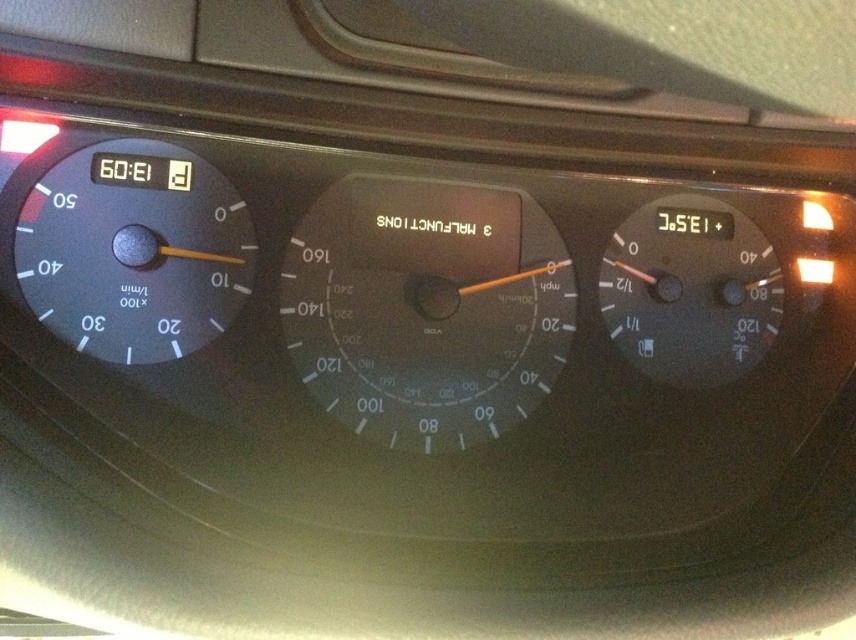
Question: Which object appears farthest from the camera in this image?

Choices:
 (A) black plastic speedometer at left
 (B) transparent glass speedometer at center

Answer: (B)

Question: Can you confirm if black plastic speedometer at left is positioned below matte black speedometer at right?

Choices:
 (A) yes
 (B) no

Answer: (B)

Question: Estimate the real-world distances between objects in this image. Which object is farther from the transparent glass speedometer at center?

Choices:
 (A) matte black speedometer at right
 (B) black plastic speedometer at left

Answer: (B)

Question: Does black plastic speedometer at left come in front of matte black speedometer at right?

Choices:
 (A) no
 (B) yes

Answer: (B)

Question: Among these points, which one is nearest to the camera?

Choices:
 (A) (191, 337)
 (B) (736, 342)

Answer: (A)

Question: Is transparent glass speedometer at center to the left of matte black speedometer at right from the viewer's perspective?

Choices:
 (A) yes
 (B) no

Answer: (A)